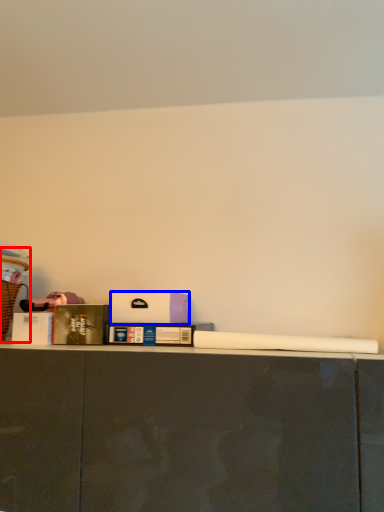
Question: Which point is closer to the camera, laundry basket (highlighted by a red box) or box (highlighted by a blue box)?

Choices:
 (A) laundry basket
 (B) box

Answer: (A)